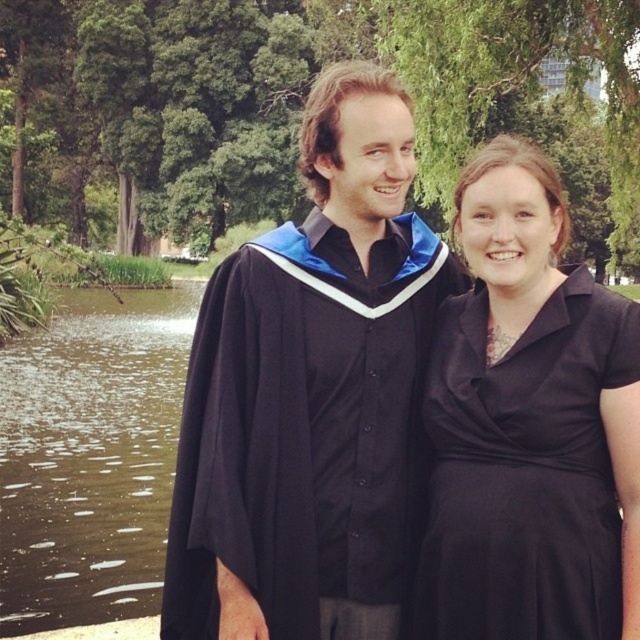
Is black matte graduation gown at center above black satin dress at center?

Yes.

Can you confirm if black matte graduation gown at center is bigger than black satin dress at center?

Indeed, black matte graduation gown at center has a larger size compared to black satin dress at center.

Describe the element at coordinates (310, 394) in the screenshot. I see `black matte graduation gown at center` at that location.

Find the location of a particular element. The image size is (640, 640). black matte graduation gown at center is located at coordinates (310, 394).